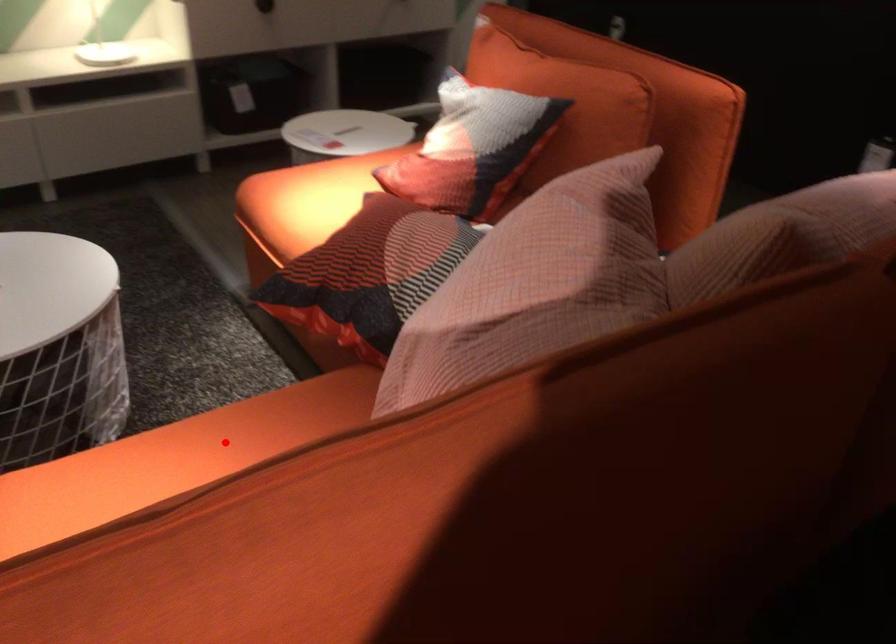
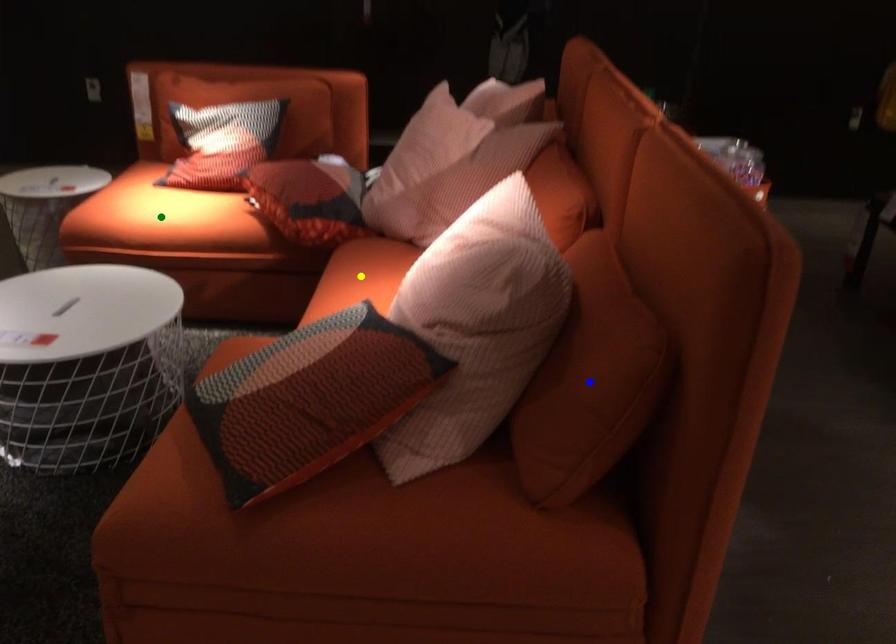
Question: I am providing you with two images of the same scene from different viewpoints. A red point is marked on the first image. You are given multiple points on the second image. Which mark in image 2 goes with the point in image 1?

Choices:
 (A) green point
 (B) yellow point
 (C) blue point

Answer: (B)